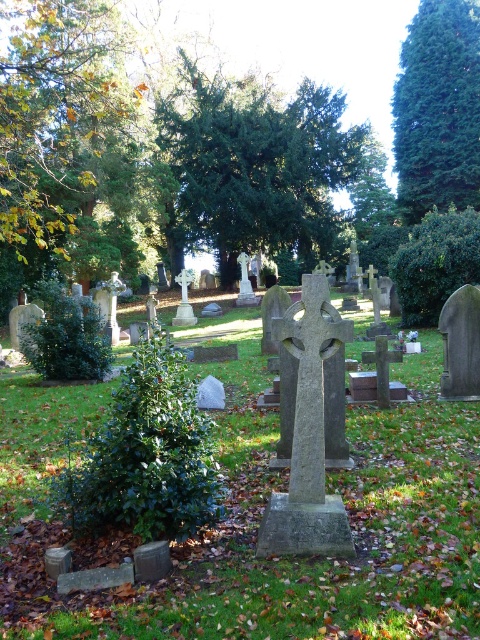
You are standing in the cemetery and want to take a photo of both point (110, 83) and point (458, 131) in the image. Since you want the closer point to be in focus, which point should you focus on?

Point (110, 83) is closer to the camera than point (458, 131), so you should focus on point (110, 83) to ensure it is in focus.

You are standing in the cemetery and want to take a photo of the green leafy tree at center and the green leafy tree at upper left. Which tree should you focus on first if you want to capture both in the same frame without moving the camera?

The green leafy tree at center is above the green leafy tree at upper left, so you should focus on the green leafy tree at upper left first to ensure both are in the frame.